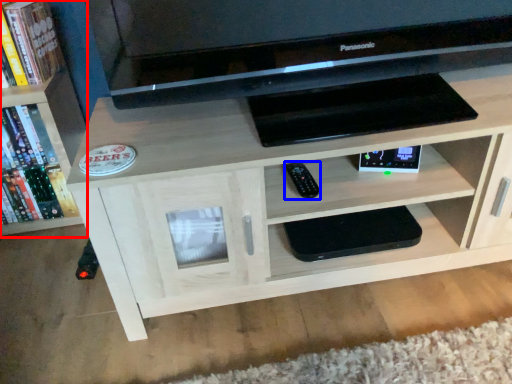
Question: Which object appears closest to the camera in this image, bookcase (highlighted by a red box) or remote (highlighted by a blue box)?

Choices:
 (A) bookcase
 (B) remote

Answer: (B)